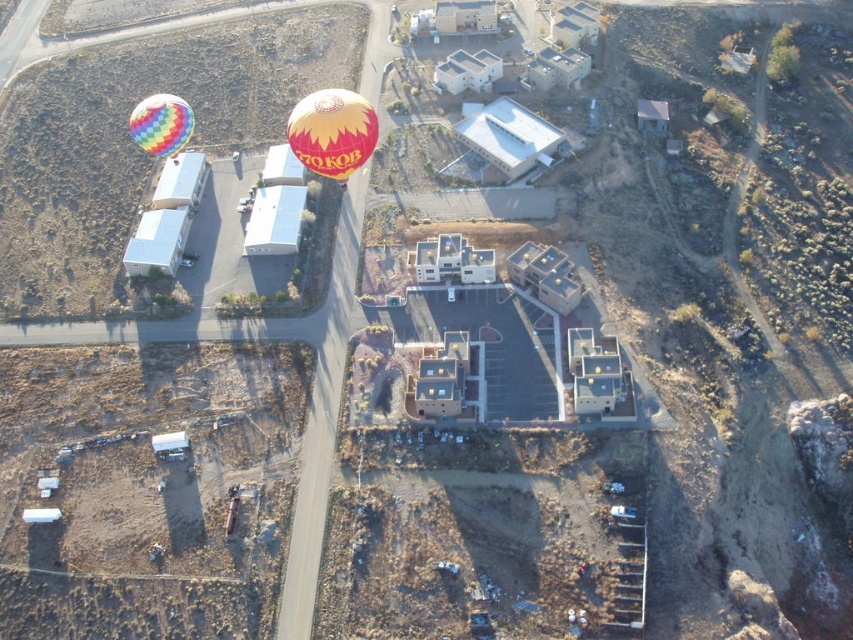
You are a photographer planning to capture a wide shot of both the yellow and orange fabric balloon at center and the rainbow striped balloon at upper left. Given that your camera can capture a maximum distance of 30 meters between the closest and farthest objects in focus, will both balloons be in focus in a single shot?

The distance between the yellow and orange fabric balloon at center and the rainbow striped balloon at upper left is 27.63 meters, which is within the camera maximum focus range of 30 meters. Therefore, both balloons will be in focus in a single shot.

What are the coordinates of the yellow and orange fabric balloon at center?

The yellow and orange fabric balloon at center is located at coordinates point (x=332, y=132).